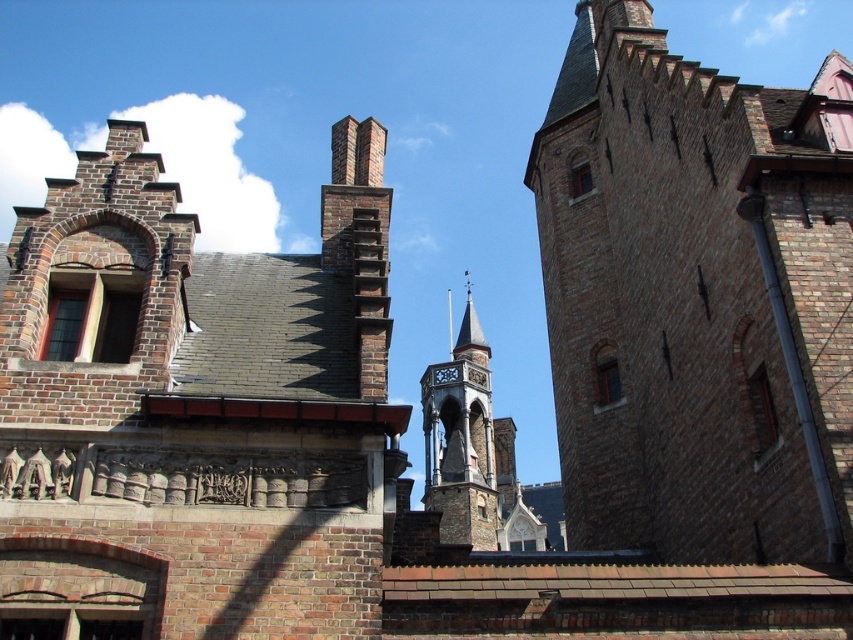
Does brown brick tower at right come behind stone steeple at center?

No.

Is brown brick tower at right to the right of stone steeple at center from the viewer's perspective?

Yes, brown brick tower at right is to the right of stone steeple at center.

Is point (720, 218) more distant than point (473, 339)?

No, it is not.

Identify the location of brown brick tower at right. Image resolution: width=853 pixels, height=640 pixels. (695, 298).

Is stone steeple at center thinner than smooth gray stone spire at center?

Incorrect, stone steeple at center's width is not less than smooth gray stone spire at center's.

What do you see at coordinates (461, 440) in the screenshot? I see `stone steeple at center` at bounding box center [461, 440].

The width and height of the screenshot is (853, 640). What do you see at coordinates (461, 440) in the screenshot?
I see `stone steeple at center` at bounding box center [461, 440].

Where is `stone steeple at center`? Image resolution: width=853 pixels, height=640 pixels. stone steeple at center is located at coordinates 461,440.

Based on the photo, is brick chimney at upper center thinner than smooth gray stone spire at center?

No.

Based on the photo, is brick chimney at upper center below smooth gray stone spire at center?

Correct, brick chimney at upper center is located below smooth gray stone spire at center.

Which is behind, point (300, 490) or point (459, 355)?

Point (459, 355)

At what (x,y) coordinates should I click in order to perform the action: click on brick chimney at upper center. Please return your answer as a coordinate pair (x, y). This screenshot has height=640, width=853. Looking at the image, I should click on (193, 410).